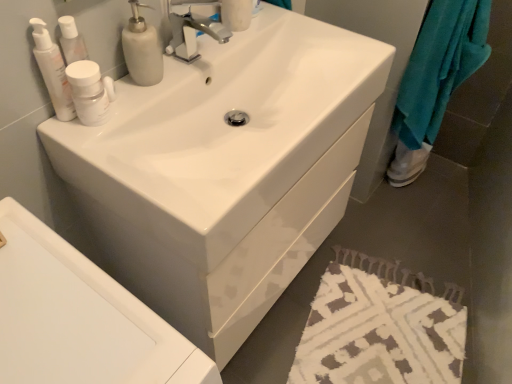
Question: Considering the positions of white glossy sink at center and white matte soap dispenser at upper left in the image, is white glossy sink at center taller or shorter than white matte soap dispenser at upper left?

Choices:
 (A) tall
 (B) short

Answer: (A)

Question: Do you think white glossy sink at center is within white matte soap dispenser at upper left, or outside of it?

Choices:
 (A) outside
 (B) inside

Answer: (A)

Question: Estimate the real-world distances between objects in this image. Which object is farther from the white matte soap dispenser at upper left?

Choices:
 (A) white glossy sink at center
 (B) white textured bath mat at lower right
 (C) white glossy sink at center
 (D) white matte bottle at upper left, which appears as the 1th mouthwash when viewed from the right
 (E) white glossy bottle at upper left, the second mouthwash viewed from the right

Answer: (B)

Question: Estimate the real-world distances between objects in this image. Which object is closer to the white glossy bottle at upper left, which is the first mouthwash from left to right?

Choices:
 (A) white matte bottle at upper left, which appears as the 1th mouthwash when viewed from the right
 (B) teal plush towel at right
 (C) white matte soap dispenser at upper left
 (D) white textured bath mat at lower right
 (E) white glossy sink at center

Answer: (A)